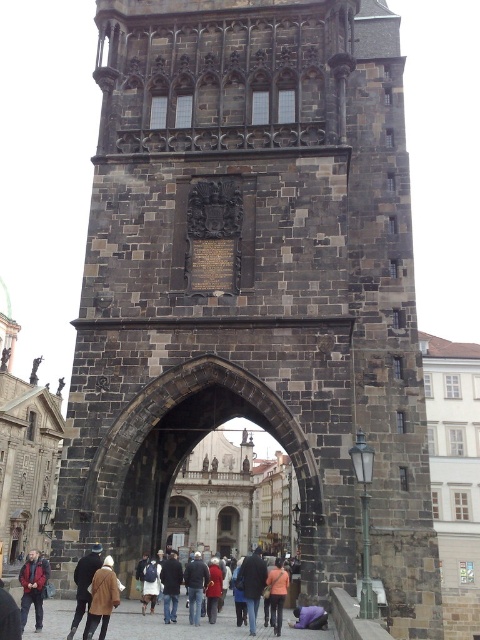
Question: Does dark blue jacket at center appear on the right side of purple fabric at lower center?

Choices:
 (A) yes
 (B) no

Answer: (B)

Question: Which point appears farthest from the camera in this image?

Choices:
 (A) (251, 593)
 (B) (189, 570)
 (C) (94, 545)
 (D) (95, 572)

Answer: (B)

Question: Which point is farther to the camera?

Choices:
 (A) (251, 630)
 (B) (164, 600)
 (C) (106, 576)

Answer: (B)

Question: Which is farther from the dark brown leather coat at lower center?

Choices:
 (A) purple fabric at lower center
 (B) dark brown leather jacket at lower left
 (C) dark gray jacket at center
 (D) dark blue jeans at center

Answer: (D)

Question: In this image, where is dark gray jacket at center located relative to purple fabric at lower center?

Choices:
 (A) below
 (B) above

Answer: (A)

Question: Does dark blue jeans at center have a greater width compared to dark gray jacket at center?

Choices:
 (A) no
 (B) yes

Answer: (A)